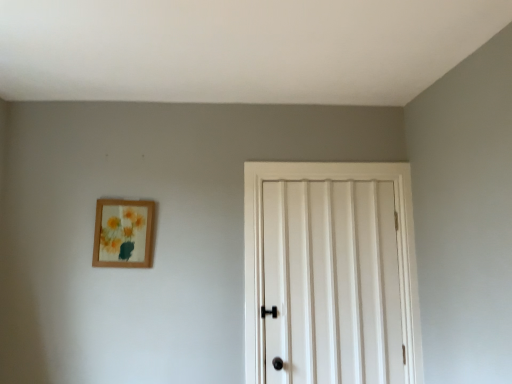
Question: From a real-world perspective, relative to wooden picture frame at upper left, is white matte door at center vertically above or below?

Choices:
 (A) below
 (B) above

Answer: (A)

Question: Considering the positions of white matte door at center and wooden picture frame at upper left in the image, is white matte door at center bigger or smaller than wooden picture frame at upper left?

Choices:
 (A) big
 (B) small

Answer: (A)

Question: From the image's perspective, is white matte door at center located above or below wooden picture frame at upper left?

Choices:
 (A) above
 (B) below

Answer: (B)

Question: In the image, is wooden picture frame at upper left on the left side or the right side of white matte door at center?

Choices:
 (A) right
 (B) left

Answer: (B)

Question: From a real-world perspective, is wooden picture frame at upper left physically located above or below white matte door at center?

Choices:
 (A) below
 (B) above

Answer: (B)

Question: In the image, is wooden picture frame at upper left positioned in front of or behind white matte door at center?

Choices:
 (A) front
 (B) behind

Answer: (B)

Question: Based on their sizes in the image, would you say wooden picture frame at upper left is bigger or smaller than white matte door at center?

Choices:
 (A) big
 (B) small

Answer: (B)